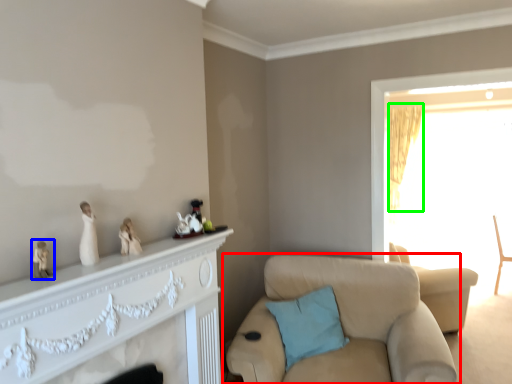
Question: Estimate the real-world distances between objects in this image. Which object is farther from chair (highlighted by a red box), toy (highlighted by a blue box) or curtain (highlighted by a green box)?

Choices:
 (A) toy
 (B) curtain

Answer: (B)